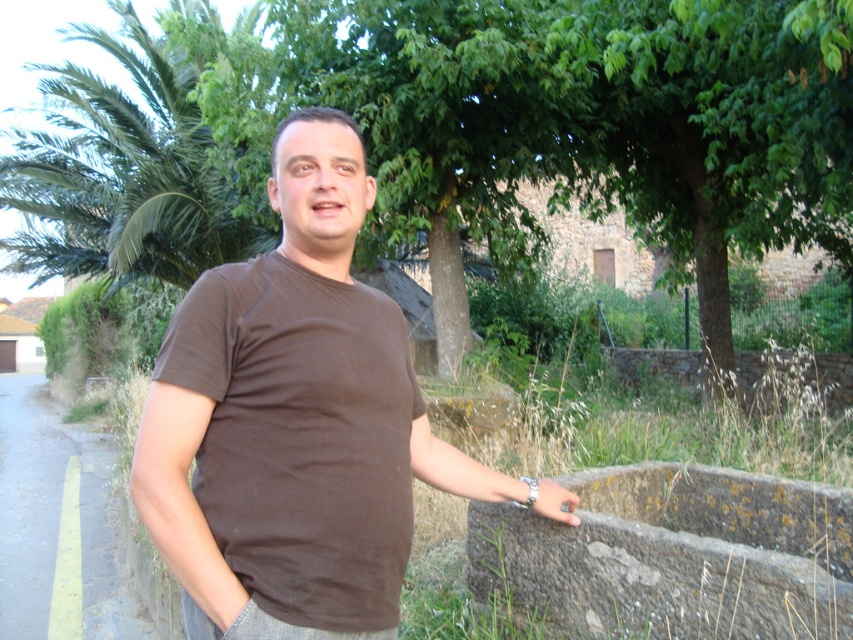
This screenshot has height=640, width=853. Identify the location of brown cotton t-shirt at center. (294, 417).

How much distance is there between brown cotton t-shirt at center and green leafy palm tree at left?

The distance of brown cotton t-shirt at center from green leafy palm tree at left is 45.34 feet.

Between point (364, 515) and point (27, 17), which one is positioned in front?

Positioned in front is point (364, 515).

Where is `brown cotton t-shirt at center`? brown cotton t-shirt at center is located at coordinates [294, 417].

Can you confirm if brown cotton t-shirt at center is positioned below matte brown t-shirt at center?

Indeed, brown cotton t-shirt at center is positioned under matte brown t-shirt at center.

Which of these two, brown cotton t-shirt at center or matte brown t-shirt at center, stands shorter?

matte brown t-shirt at center

Does point (393, 392) come behind point (236, 532)?

Yes, point (393, 392) is behind point (236, 532).

In order to click on brown cotton t-shirt at center in this screenshot , I will do `click(294, 417)`.

Which is below, matte brown t-shirt at center or matte brown hand at lower right?

matte brown hand at lower right is lower down.

Does matte brown t-shirt at center have a lesser width compared to matte brown hand at lower right?

In fact, matte brown t-shirt at center might be wider than matte brown hand at lower right.

Who is more forward, (256,369) or (576,506)?

Point (256,369) is more forward.

Locate an element on the screen. matte brown t-shirt at center is located at coordinates (300, 436).